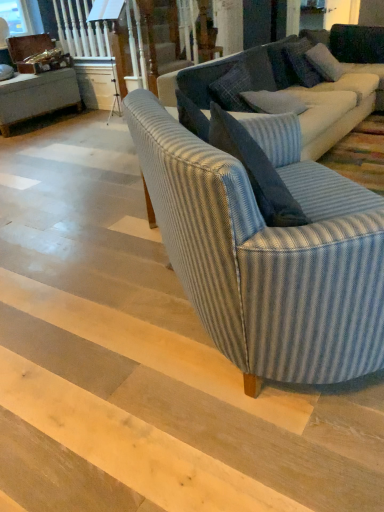
At what (x,y) coordinates should I click in order to perform the action: click on blue textured pillow at upper right, the second pillow in the front-to-back sequence. Please return your answer as a coordinate pair (x, y). Looking at the image, I should click on (324, 63).

Find the location of a particular element. This screenshot has height=512, width=384. blue textured pillow at center, which is counted as the 1th pillow, starting from the front is located at coordinates (273, 102).

From the image's perspective, is blue textured pillow at upper right, positioned as the 2th pillow in back-to-front order, positioned above or below blue striped fabric couch at center, which is the 2th studio couch in back-to-front order?

Clearly, from the image's perspective, blue textured pillow at upper right, positioned as the 2th pillow in back-to-front order, is above blue striped fabric couch at center, which is the 2th studio couch in back-to-front order.

From the picture: Is blue textured pillow at upper right, positioned as the 2th pillow in back-to-front order, thinner than blue striped fabric couch at center, which is the 2th studio couch in back-to-front order?

Yes, blue textured pillow at upper right, positioned as the 2th pillow in back-to-front order, is thinner than blue striped fabric couch at center, which is the 2th studio couch in back-to-front order.

Who is more distant, blue textured pillow at upper right, the second pillow in the front-to-back sequence, or blue striped fabric couch at center, placed as the 1th studio couch when sorted from front to back?

Positioned behind is blue textured pillow at upper right, the second pillow in the front-to-back sequence.

Considering the positions of objects blue textured pillow at center, which is counted as the 1th pillow, starting from the front, and blue textured pillow at upper right, the 3th pillow viewed from the front, in the image provided, who is in front, blue textured pillow at center, which is counted as the 1th pillow, starting from the front, or blue textured pillow at upper right, the 3th pillow viewed from the front,?

blue textured pillow at center, which is counted as the 1th pillow, starting from the front, is in front.

Considering the points (258, 108) and (291, 38), which point is behind, point (258, 108) or point (291, 38)?

The point (291, 38) is more distant.

Is blue textured pillow at center, which is counted as the 1th pillow, starting from the front, turned away from blue textured pillow at upper right, the 3th pillow viewed from the front?

blue textured pillow at center, which is counted as the 1th pillow, starting from the front, is not turned away from blue textured pillow at upper right, the 3th pillow viewed from the front.

Find the location of a particular element. The width and height of the screenshot is (384, 512). studio couch above the blue textured pillow at center, which is counted as the 1th pillow, starting from the front (from the image's perspective) is located at coordinates (339, 106).

From a real-world perspective, relative to blue striped fabric couch at center, arranged as the 2th studio couch when viewed from the front, is blue textured pillow at center, which is counted as the 1th pillow, starting from the front, vertically above or below?

In terms of real-world spatial position, blue textured pillow at center, which is counted as the 1th pillow, starting from the front, is above blue striped fabric couch at center, arranged as the 2th studio couch when viewed from the front.

Is blue textured pillow at center, which is counted as the 1th pillow, starting from the front, facing towards blue striped fabric couch at center, arranged as the 2th studio couch when viewed from the front?

Yes, blue textured pillow at center, which is counted as the 1th pillow, starting from the front, is facing blue striped fabric couch at center, arranged as the 2th studio couch when viewed from the front.

Based on the photo, from the image's perspective, is blue textured pillow at center, placed as the 3th pillow when sorted from back to front, above or below blue striped fabric couch at center, arranged as the 2th studio couch when viewed from the front?

blue textured pillow at center, placed as the 3th pillow when sorted from back to front, is situated lower than blue striped fabric couch at center, arranged as the 2th studio couch when viewed from the front, in the image.

Is blue textured pillow at upper right, positioned as the 2th pillow in back-to-front order, wider or thinner than blue textured pillow at upper right, placed as the first pillow when sorted from back to front?

blue textured pillow at upper right, positioned as the 2th pillow in back-to-front order, is thinner than blue textured pillow at upper right, placed as the first pillow when sorted from back to front.

From a real-world perspective, is blue textured pillow at upper right, the second pillow in the front-to-back sequence, under blue textured pillow at upper right, placed as the first pillow when sorted from back to front?

No, from a real-world perspective, blue textured pillow at upper right, the second pillow in the front-to-back sequence, is not below blue textured pillow at upper right, placed as the first pillow when sorted from back to front.

Is blue textured pillow at upper right, the second pillow in the front-to-back sequence, at the left side of blue textured pillow at upper right, the 3th pillow viewed from the front?

No, blue textured pillow at upper right, the second pillow in the front-to-back sequence, is not to the left of blue textured pillow at upper right, the 3th pillow viewed from the front.

Is blue textured pillow at upper right, the second pillow in the front-to-back sequence, not inside blue textured pillow at upper right, placed as the first pillow when sorted from back to front?

Yes, blue textured pillow at upper right, the second pillow in the front-to-back sequence, is not within blue textured pillow at upper right, placed as the first pillow when sorted from back to front.

Does blue striped fabric couch at center, arranged as the 2th studio couch when viewed from the front, turn towards blue striped fabric armchair at center?

No, blue striped fabric couch at center, arranged as the 2th studio couch when viewed from the front, is not aimed at blue striped fabric armchair at center.

How many degrees apart are the facing directions of blue striped fabric couch at center, arranged as the 2th studio couch when viewed from the front, and blue striped fabric armchair at center?

88.3 degrees.

From a real-world perspective, is blue striped fabric couch at center, which is the 1th studio couch in back-to-front order, physically below blue striped fabric armchair at center?

No.

Is blue striped fabric couch at center, which is the 1th studio couch in back-to-front order, next to blue striped fabric armchair at center and touching it?

No, blue striped fabric couch at center, which is the 1th studio couch in back-to-front order, is not with blue striped fabric armchair at center.

Locate an element on the screen. The image size is (384, 512). stairwell below the blue textured pillow at center, which is counted as the 1th pillow, starting from the front (from the image's perspective) is located at coordinates click(x=177, y=412).

Is blue striped fabric armchair at center far from blue textured pillow at center, which is counted as the 1th pillow, starting from the front?

Yes.

Is blue striped fabric armchair at center at the right side of blue textured pillow at center, which is counted as the 1th pillow, starting from the front?

In fact, blue striped fabric armchair at center is to the left of blue textured pillow at center, which is counted as the 1th pillow, starting from the front.

Is blue striped fabric armchair at center wider than blue textured pillow at center, which is counted as the 1th pillow, starting from the front?

Correct, the width of blue striped fabric armchair at center exceeds that of blue textured pillow at center, which is counted as the 1th pillow, starting from the front.

The image size is (384, 512). What are the coordinates of `the 1st pillow to the right of the blue striped fabric couch at center, which is the 2th studio couch in back-to-front order, counting from the anchor's position` in the screenshot? It's located at (273, 102).

How different are the orientations of blue striped fabric couch at center, which is the 2th studio couch in back-to-front order, and blue textured pillow at center, which is counted as the 1th pillow, starting from the front, in degrees?

There is a 51.2-degree angle between the facing directions of blue striped fabric couch at center, which is the 2th studio couch in back-to-front order, and blue textured pillow at center, which is counted as the 1th pillow, starting from the front.

How distant is blue striped fabric couch at center, placed as the 1th studio couch when sorted from front to back, from blue textured pillow at center, which is counted as the 1th pillow, starting from the front?

A distance of 1.58 meters exists between blue striped fabric couch at center, placed as the 1th studio couch when sorted from front to back, and blue textured pillow at center, which is counted as the 1th pillow, starting from the front.

Is blue striped fabric couch at center, which is the 2th studio couch in back-to-front order, not within blue textured pillow at center, placed as the 3th pillow when sorted from back to front?

Absolutely, blue striped fabric couch at center, which is the 2th studio couch in back-to-front order, is external to blue textured pillow at center, placed as the 3th pillow when sorted from back to front.

Where is `the 2nd studio couch counting from the left side of the blue textured pillow at upper right, the second pillow in the front-to-back sequence`? This screenshot has width=384, height=512. the 2nd studio couch counting from the left side of the blue textured pillow at upper right, the second pillow in the front-to-back sequence is located at coordinates (268, 250).

This screenshot has height=512, width=384. I want to click on the 2nd pillow behind the blue textured pillow at center, which is counted as the 1th pillow, starting from the front, counting from the anchor's position, so click(x=282, y=62).

In the scene shown: Which object lies nearer to the anchor point blue textured pillow at upper right, positioned as the 2th pillow in back-to-front order, blue textured pillow at center, which is counted as the 1th pillow, starting from the front, or blue striped fabric couch at center, arranged as the 2th studio couch when viewed from the front?

Among the two, blue striped fabric couch at center, arranged as the 2th studio couch when viewed from the front, is located nearer to blue textured pillow at upper right, positioned as the 2th pillow in back-to-front order.

When comparing their distances from blue textured pillow at upper right, the second pillow in the front-to-back sequence, does blue textured pillow at center, which is counted as the 1th pillow, starting from the front, or blue textured pillow at upper right, placed as the first pillow when sorted from back to front, seem further?

The object further to blue textured pillow at upper right, the second pillow in the front-to-back sequence, is blue textured pillow at center, which is counted as the 1th pillow, starting from the front.

Looking at the image, which one is located closer to blue striped fabric couch at center, arranged as the 2th studio couch when viewed from the front, blue textured pillow at upper right, the 3th pillow viewed from the front, or blue textured pillow at upper right, positioned as the 2th pillow in back-to-front order?

blue textured pillow at upper right, positioned as the 2th pillow in back-to-front order.

Looking at the image, which one is located closer to blue textured pillow at center, which is counted as the 1th pillow, starting from the front, blue striped fabric couch at center, which is the 1th studio couch in back-to-front order, or blue textured pillow at upper right, the 3th pillow viewed from the front?

Based on the image, blue striped fabric couch at center, which is the 1th studio couch in back-to-front order, appears to be nearer to blue textured pillow at center, which is counted as the 1th pillow, starting from the front.

Based on their spatial positions, is blue textured pillow at upper right, placed as the first pillow when sorted from back to front, or blue striped fabric armchair at center further from blue striped fabric couch at center, which is the 1th studio couch in back-to-front order?

blue striped fabric armchair at center is positioned further to the anchor blue striped fabric couch at center, which is the 1th studio couch in back-to-front order.

Which object lies further to the anchor point blue textured pillow at upper right, placed as the first pillow when sorted from back to front, blue striped fabric armchair at center or blue textured pillow at upper right, positioned as the 2th pillow in back-to-front order?

blue striped fabric armchair at center is further to blue textured pillow at upper right, placed as the first pillow when sorted from back to front.

Looking at the image, which one is located closer to blue striped fabric couch at center, arranged as the 2th studio couch when viewed from the front, blue striped fabric armchair at center or blue textured pillow at upper right, the 3th pillow viewed from the front?

blue textured pillow at upper right, the 3th pillow viewed from the front, lies closer to blue striped fabric couch at center, arranged as the 2th studio couch when viewed from the front, than the other object.

Looking at the image, which one is located closer to blue striped fabric armchair at center, blue textured pillow at center, which is counted as the 1th pillow, starting from the front, or blue striped fabric couch at center, which is the 1th studio couch in back-to-front order?

blue textured pillow at center, which is counted as the 1th pillow, starting from the front, is positioned closer to the anchor blue striped fabric armchair at center.

Where is `studio couch between blue striped fabric couch at center, which is the 2th studio couch in back-to-front order, and blue textured pillow at upper right, placed as the first pillow when sorted from back to front, from front to back`? The height and width of the screenshot is (512, 384). studio couch between blue striped fabric couch at center, which is the 2th studio couch in back-to-front order, and blue textured pillow at upper right, placed as the first pillow when sorted from back to front, from front to back is located at coordinates (339, 106).

Where is `pillow located between blue striped fabric armchair at center and blue textured pillow at upper right, positioned as the 2th pillow in back-to-front order, in the depth direction`? This screenshot has height=512, width=384. pillow located between blue striped fabric armchair at center and blue textured pillow at upper right, positioned as the 2th pillow in back-to-front order, in the depth direction is located at coordinates (273, 102).

This screenshot has height=512, width=384. I want to click on studio couch located between blue striped fabric couch at center, placed as the 1th studio couch when sorted from front to back, and blue textured pillow at upper right, positioned as the 2th pillow in back-to-front order, in the depth direction, so click(x=339, y=106).

The height and width of the screenshot is (512, 384). In order to click on pillow positioned between blue textured pillow at center, which is counted as the 1th pillow, starting from the front, and blue textured pillow at upper right, the 3th pillow viewed from the front, from near to far in this screenshot , I will do `click(324, 63)`.